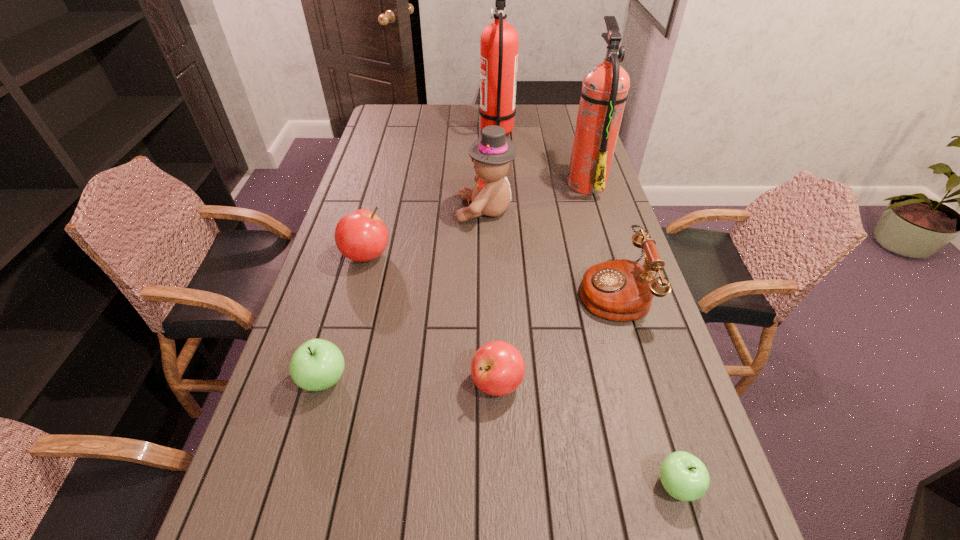
I want to click on the left fire extinguisher, so click(x=499, y=41).

In order to click on red fire extinguisher in this screenshot , I will do pyautogui.click(x=499, y=41).

The width and height of the screenshot is (960, 540). What are the coordinates of `the nearer fire extinguisher` in the screenshot? It's located at (604, 92).

Find the location of a particular element. rag_doll is located at coordinates (491, 154).

This screenshot has width=960, height=540. Find the location of `telephone`. telephone is located at coordinates (620, 290).

I want to click on the tallest apple, so click(x=361, y=236).

Where is `the bigger red apple`? the bigger red apple is located at coordinates (361, 236).

Find the location of `the farther green apple`. the farther green apple is located at coordinates (317, 364).

At what (x,y) coordinates should I click in order to perform the action: click on the bigger green apple. Please return your answer as a coordinate pair (x, y). Image resolution: width=960 pixels, height=540 pixels. Looking at the image, I should click on (317, 364).

This screenshot has width=960, height=540. I want to click on the second apple from right to left, so click(497, 368).